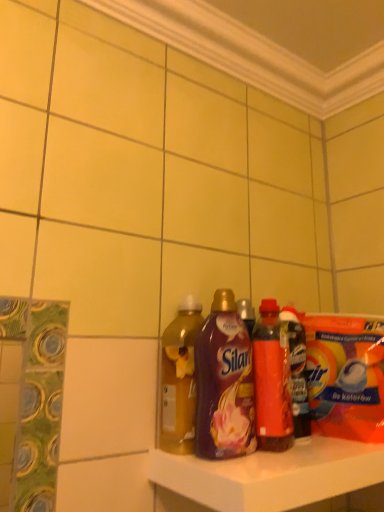
Question: Is shiny plastic bottle at center, the 2th bottle when ordered from right to left, to the left or to the right of purple plastic bottle at center, the second bottle in the left-to-right sequence, in the image?

Choices:
 (A) right
 (B) left

Answer: (A)

Question: Relative to purple plastic bottle at center, the second bottle in the left-to-right sequence, is shiny plastic bottle at center, the 2th bottle when ordered from right to left, in front or behind?

Choices:
 (A) behind
 (B) front

Answer: (A)

Question: Which is nearer to the translucent plastic bottle at center, placed as the 1th bottle when sorted from right to left?

Choices:
 (A) purple plastic bottle at center, which ranks as the 3th bottle in right-to-left order
 (B) translucent yellow liquid at center, placed as the first bottle when sorted from left to right
 (C) shiny plastic bottle at center, the 2th bottle when ordered from right to left

Answer: (C)

Question: Which is farther from the translucent plastic bottle at center, which is counted as the 4th bottle, starting from the left?

Choices:
 (A) translucent yellow liquid at center, placed as the first bottle when sorted from left to right
 (B) shiny plastic bottle at center, the 2th bottle when ordered from right to left
 (C) purple plastic bottle at center, which ranks as the 3th bottle in right-to-left order

Answer: (A)